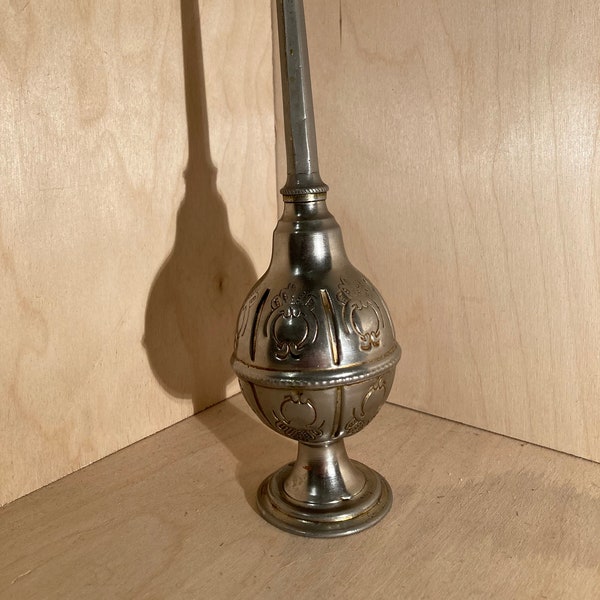
In order to click on wall in this screenshot , I will do `click(542, 221)`, `click(122, 326)`.